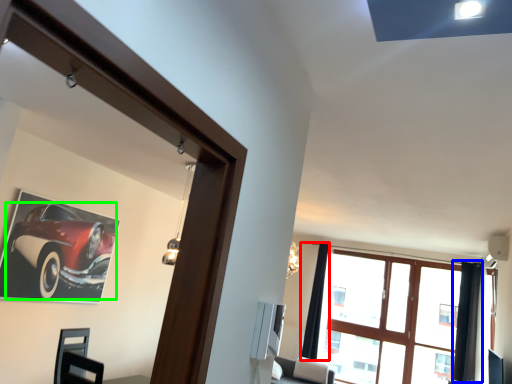
Question: Which object is positioned farthest from curtain (highlighted by a red box)? Select from curtain (highlighted by a blue box) and car (highlighted by a green box).

Choices:
 (A) curtain
 (B) car

Answer: (B)